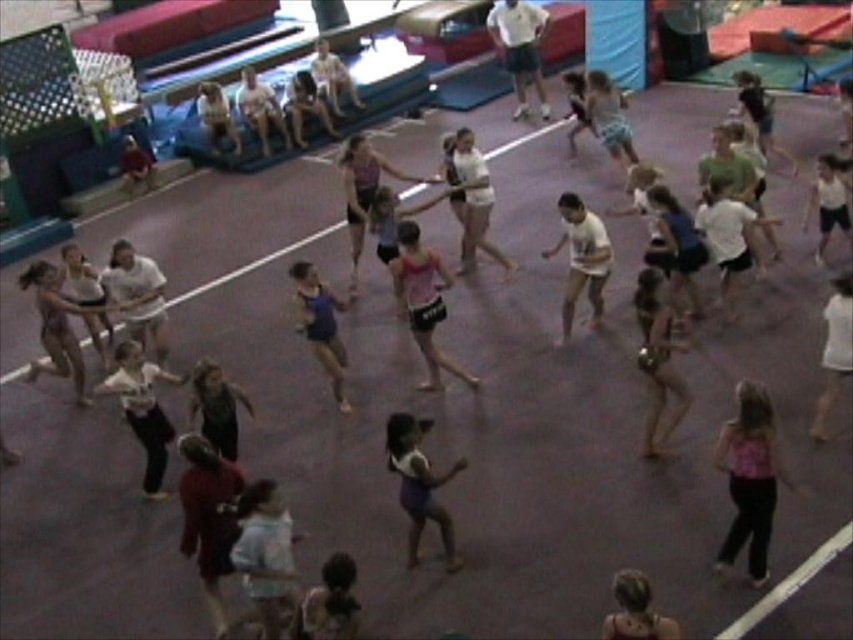
Question: Does pink fabric top at lower right appear on the right side of white matte shirt at center?

Choices:
 (A) yes
 (B) no

Answer: (A)

Question: Estimate the real-world distances between objects in this image. Which object is farther from the matte blue tank top at center?

Choices:
 (A) light blue fabric at center
 (B) pink fabric top at lower right

Answer: (B)

Question: Which object appears farthest from the camera in this image?

Choices:
 (A) pink fabric top at lower right
 (B) light blue fabric at center
 (C) white matte shirt at center
 (D) matte blue tank top at center

Answer: (C)

Question: Is light blue fabric at center bigger than matte blue tank top at center?

Choices:
 (A) yes
 (B) no

Answer: (B)

Question: Which of the following is the farthest from the observer?

Choices:
 (A) matte blue tank top at center
 (B) light blue fabric at center
 (C) white matte shirt at center

Answer: (C)

Question: Can you confirm if pink fabric top at lower right is positioned above matte blue tank top at center?

Choices:
 (A) no
 (B) yes

Answer: (A)